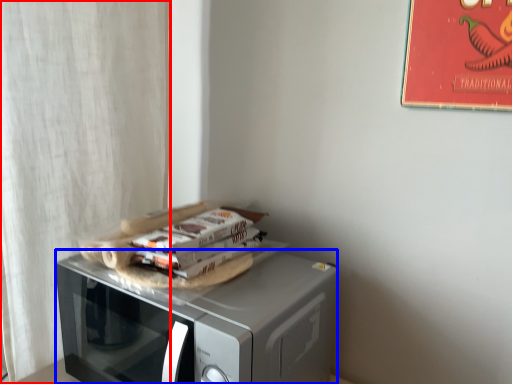
Question: Which object is closer to the camera taking this photo, curtain (highlighted by a red box) or microwave oven (highlighted by a blue box)?

Choices:
 (A) curtain
 (B) microwave oven

Answer: (B)